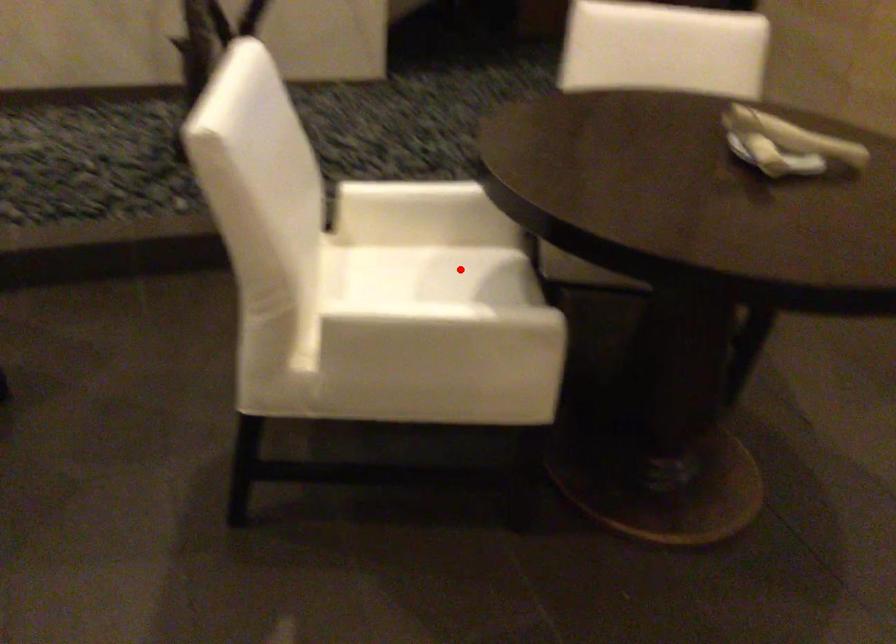
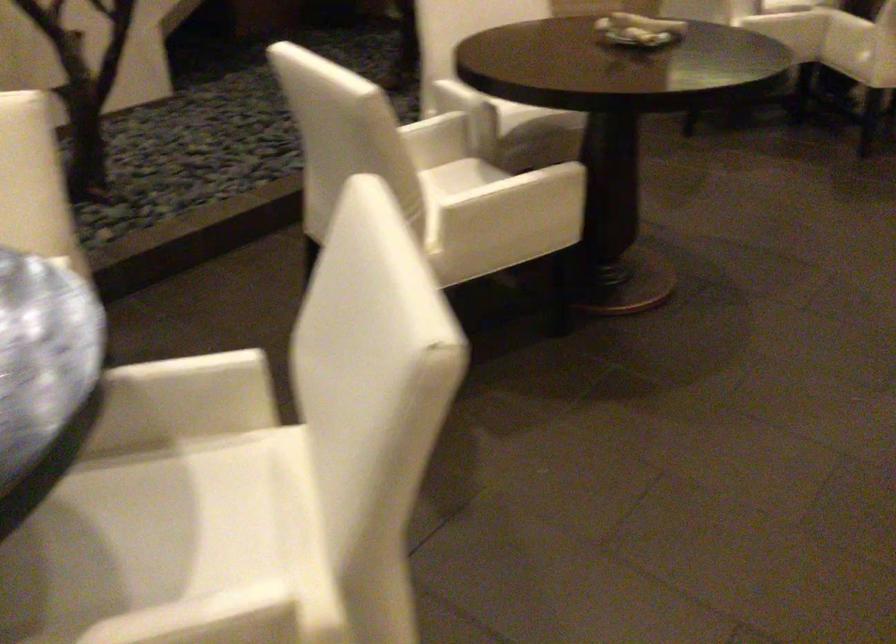
Question: I am providing you with two images of the same scene from different viewpoints. Given a red point in image1, look at the same physical point in image2. Is it:

Choices:
 (A) Closer to the viewpoint
 (B) Farther from the viewpoint

Answer: (B)